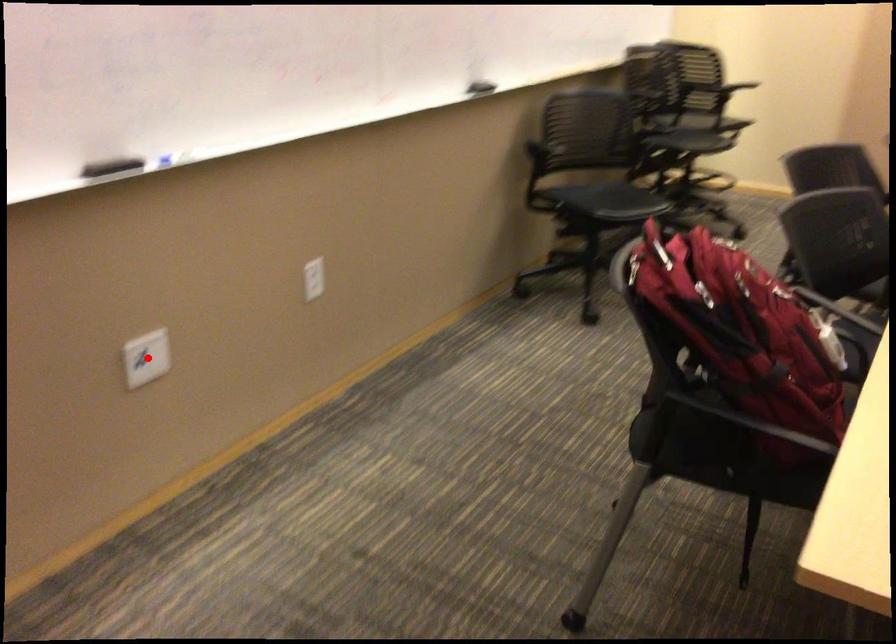
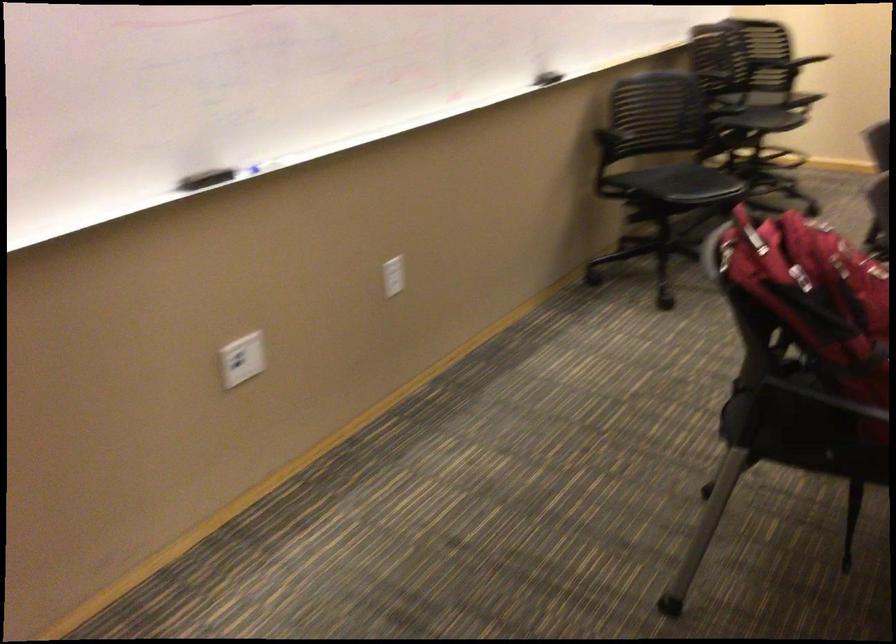
In the second image, find the point that corresponds to the highlighted location in the first image.

(242, 359)